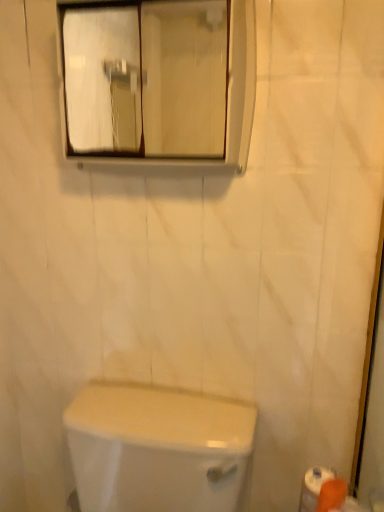
Question: Is orange matte toilet paper at lower right smaller than clear glass mirror at upper center?

Choices:
 (A) yes
 (B) no

Answer: (A)

Question: Considering the relative sizes of orange matte toilet paper at lower right and clear glass mirror at upper center in the image provided, is orange matte toilet paper at lower right thinner than clear glass mirror at upper center?

Choices:
 (A) yes
 (B) no

Answer: (A)

Question: Is orange matte toilet paper at lower right positioned behind clear glass mirror at upper center?

Choices:
 (A) no
 (B) yes

Answer: (B)

Question: Considering the relative positions of orange matte toilet paper at lower right and clear glass mirror at upper center in the image provided, is orange matte toilet paper at lower right to the right of clear glass mirror at upper center from the viewer's perspective?

Choices:
 (A) yes
 (B) no

Answer: (A)

Question: Is clear glass mirror at upper center inside orange matte toilet paper at lower right?

Choices:
 (A) no
 (B) yes

Answer: (A)

Question: Is orange matte toilet paper at lower right bigger or smaller than clear glass mirror at upper center?

Choices:
 (A) big
 (B) small

Answer: (B)

Question: From a real-world perspective, is orange matte toilet paper at lower right physically located above or below clear glass mirror at upper center?

Choices:
 (A) above
 (B) below

Answer: (B)

Question: Considering the positions of orange matte toilet paper at lower right and clear glass mirror at upper center in the image, is orange matte toilet paper at lower right wider or thinner than clear glass mirror at upper center?

Choices:
 (A) thin
 (B) wide

Answer: (A)

Question: From the image's perspective, is orange matte toilet paper at lower right located above or below clear glass mirror at upper center?

Choices:
 (A) above
 (B) below

Answer: (B)

Question: Does point (119, 137) appear closer or farther from the camera than point (306, 502)?

Choices:
 (A) farther
 (B) closer

Answer: (A)

Question: From the image's perspective, is clear glass mirror at upper center above or below orange matte toilet paper at lower right?

Choices:
 (A) below
 (B) above

Answer: (B)

Question: In the image, is clear glass mirror at upper center positioned in front of or behind orange matte toilet paper at lower right?

Choices:
 (A) behind
 (B) front

Answer: (B)

Question: Is clear glass mirror at upper center wider or thinner than orange matte toilet paper at lower right?

Choices:
 (A) wide
 (B) thin

Answer: (A)

Question: From a real-world perspective, is clear glass mirror at upper center physically located above or below white glossy toilet at lower center?

Choices:
 (A) below
 (B) above

Answer: (B)

Question: Based on their positions, is clear glass mirror at upper center located to the left or right of white glossy toilet at lower center?

Choices:
 (A) right
 (B) left

Answer: (A)